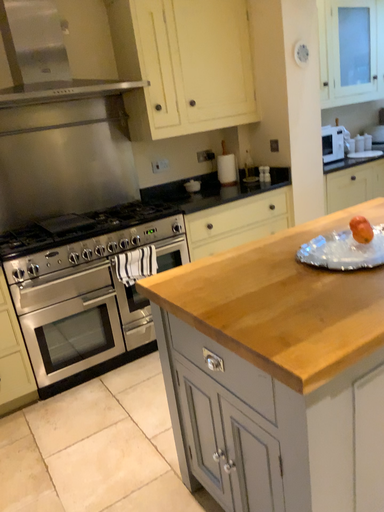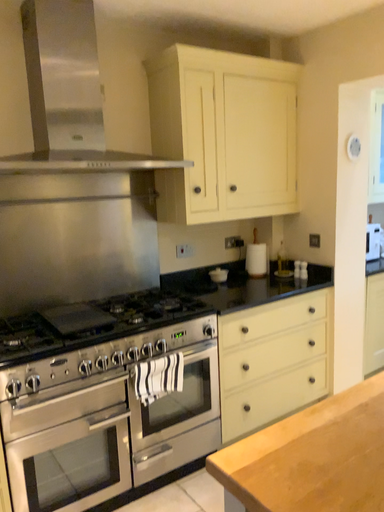
Question: Which way did the camera rotate in the video?

Choices:
 (A) rotated downward
 (B) rotated upward

Answer: (B)